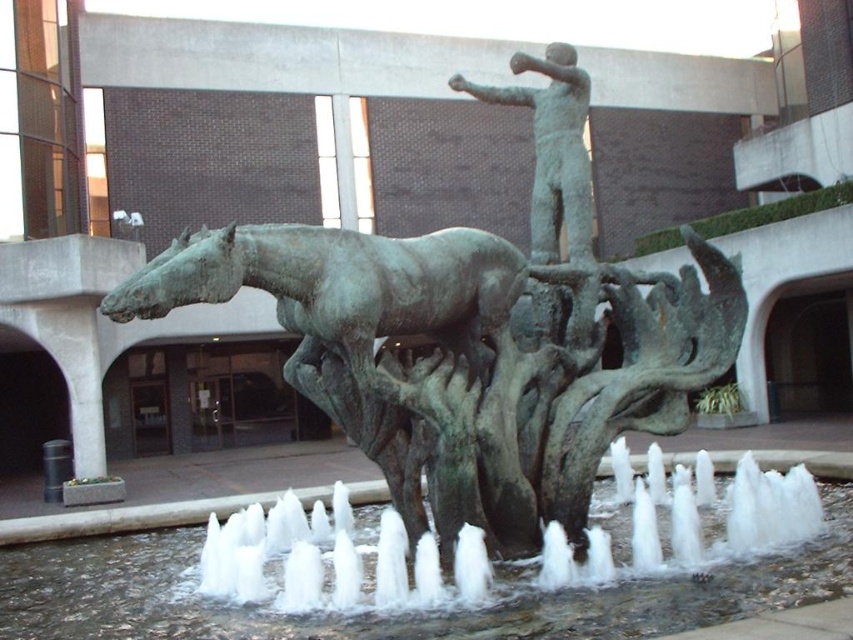
Consider the image. You are standing at the center of the plaza looking at the sculpture. There are two points marked on the sculpture. The first point is at coordinates point (618, 513) and the second point is at point (492, 310). Which point is closer to you?

Point (492, 310) is closer to you because it is in front of point (618, 513).

You are standing in the plaza and want to find the clear water at fountain center. According to the scene description, where should you look relative to the bronze sculpture?

The clear water at fountain center is located at point coordinates, so you should look towards the center of the fountain area where the sculpture is situated.

You are standing in the plaza and want to take a photo of the bronze statue at center. If your camera can focus on objects up to 5 meters away, will you need to move closer to capture a clear photo?

The bronze statue at center is 5.63 meters away from the viewer. Since the camera can only focus up to 5 meters, you need to move closer to ensure the statue is within the camera range.